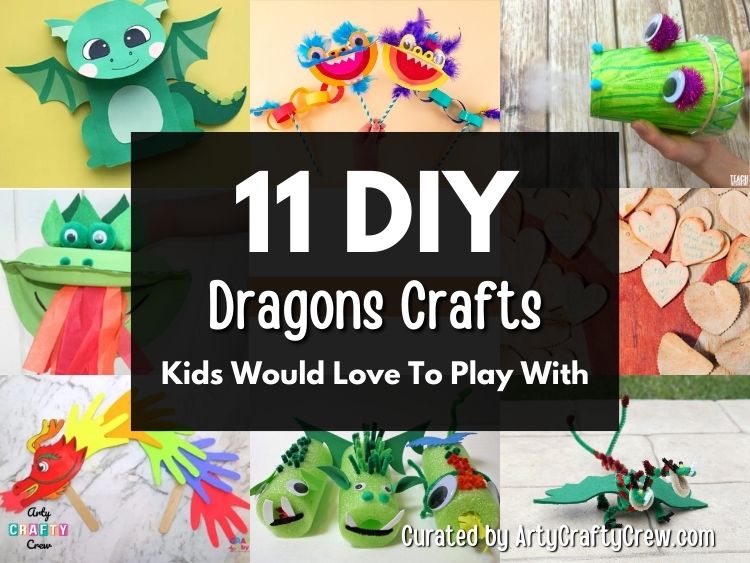
This screenshot has height=563, width=750. Find the location of `marble counter`. marble counter is located at coordinates (123, 513).